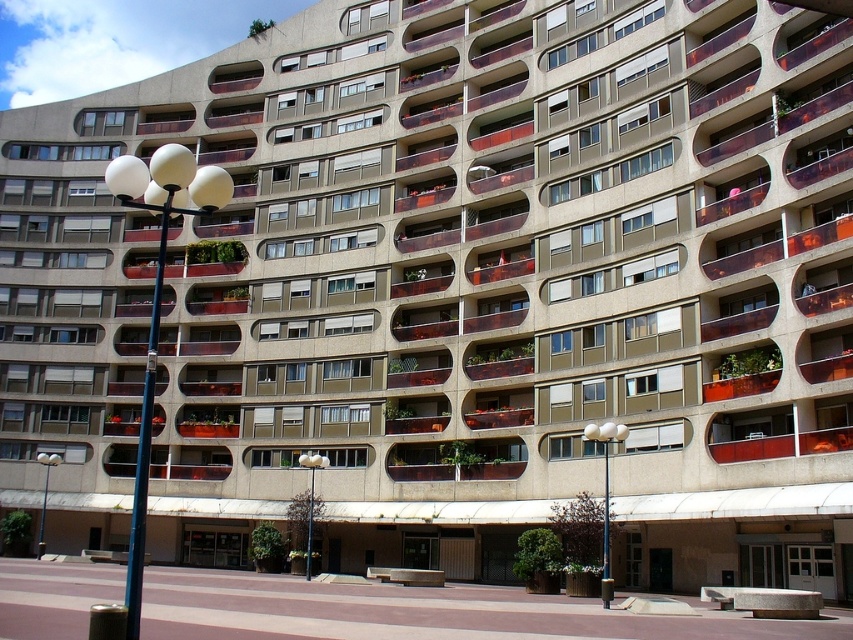
Question: Is metallic streetlight at center to the left of white glossy lamp post at lower left from the viewer's perspective?

Choices:
 (A) no
 (B) yes

Answer: (A)

Question: Where is white glossy lamp post at left located in relation to white glossy lamp post at lower left in the image?

Choices:
 (A) above
 (B) below

Answer: (A)

Question: Is white glossy lamp post at center positioned behind white glossy lamp post at lower left?

Choices:
 (A) no
 (B) yes

Answer: (A)

Question: Which object is closer to the camera taking this photo?

Choices:
 (A) white glossy lamp post at lower left
 (B) white glossy lamp post at left

Answer: (B)

Question: Which object is positioned farthest from the white glossy lamp post at center?

Choices:
 (A) white glossy lamp post at left
 (B) metallic streetlight at center
 (C) white glossy lamp post at lower left

Answer: (C)

Question: Which object is closer to the camera taking this photo?

Choices:
 (A) white glossy lamp post at left
 (B) white glossy lamp post at center
 (C) metallic streetlight at center

Answer: (A)